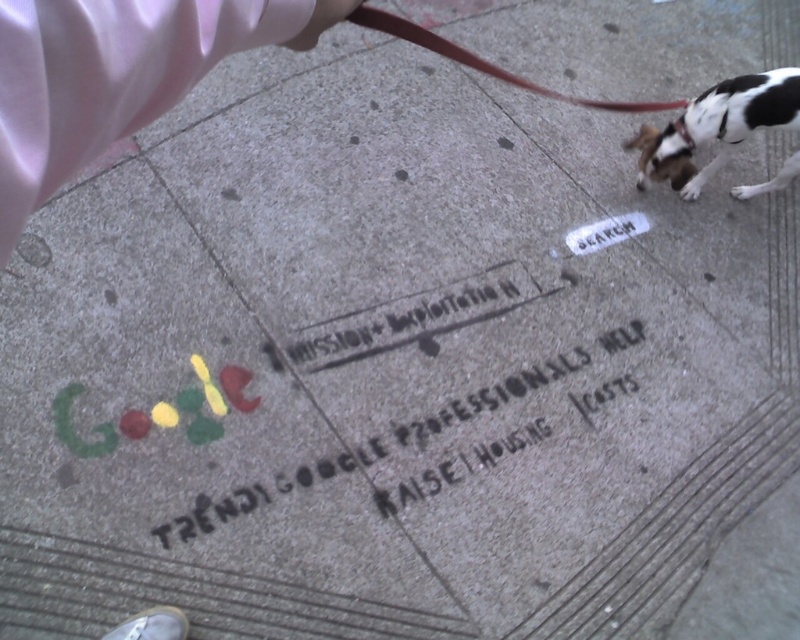
Question: Which point is closer to the camera taking this photo?

Choices:
 (A) (168, 17)
 (B) (409, 35)
 (C) (462, 422)

Answer: (A)

Question: Does pink satin ribbon at upper left have a lesser width compared to brown leather leash at upper center?

Choices:
 (A) yes
 (B) no

Answer: (A)

Question: Which of the following is the farthest from the observer?

Choices:
 (A) brown leather leash at upper center
 (B) white and black fur dog at upper right
 (C) black stenciled text at center
 (D) pink satin ribbon at upper left

Answer: (A)

Question: Which point is farther to the camera?

Choices:
 (A) (214, 60)
 (B) (582, 104)
 (C) (250, 509)
 (D) (709, 108)

Answer: (B)

Question: Is pink satin ribbon at upper left bigger than white and black fur dog at upper right?

Choices:
 (A) yes
 (B) no

Answer: (B)

Question: Does pink satin ribbon at upper left have a smaller size compared to brown leather leash at upper center?

Choices:
 (A) yes
 (B) no

Answer: (A)